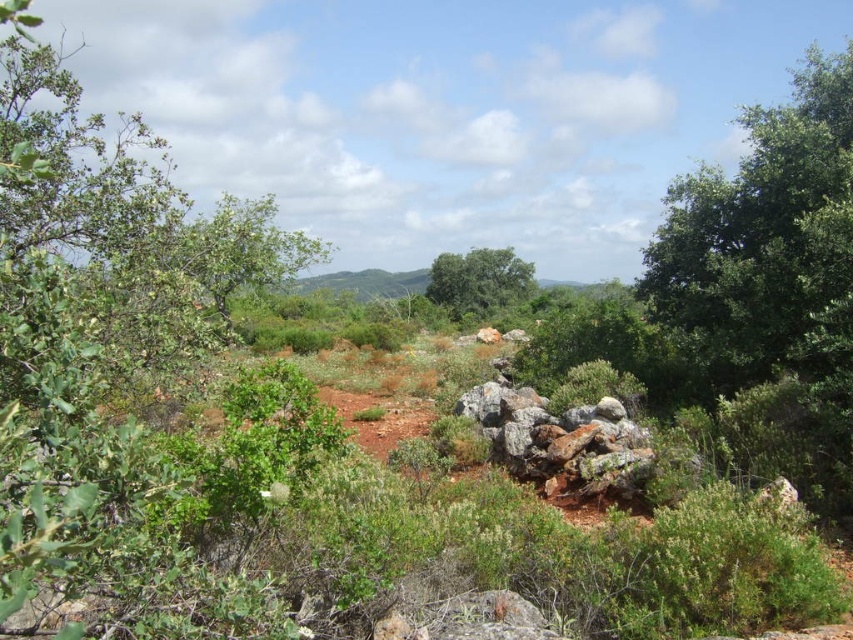
You are a hiker trying to navigate through the dense vegetation. You see two landmarks, the green leafy tree at left and the green leafy tree at center. Which tree should you head towards if you want to find the highest point in this area?

The green leafy tree at left is taller than the green leafy tree at center, so you should head towards the green leafy tree at left to reach the highest point.

You are a hiker trying to navigate through the dense vegetation in the foreground. You notice two landmarks, the green leafy tree at left and the green leafy tree at center. Which tree should you approach if you want to find a wider clearing for setting up camp?

You should approach the green leafy tree at left because it is bigger than the green leafy tree at center, suggesting a wider clearing around it.